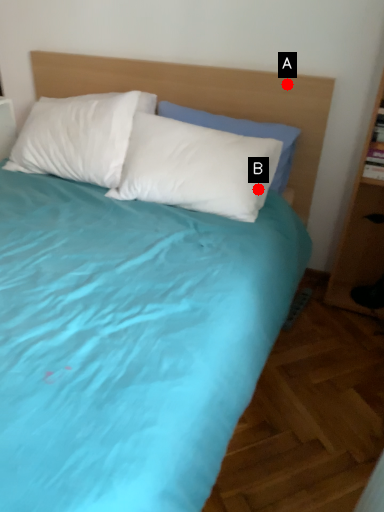
Question: Two points are circled on the image, labeled by A and B beside each circle. Which point is further to the camera?

Choices:
 (A) A is further
 (B) B is further

Answer: (A)